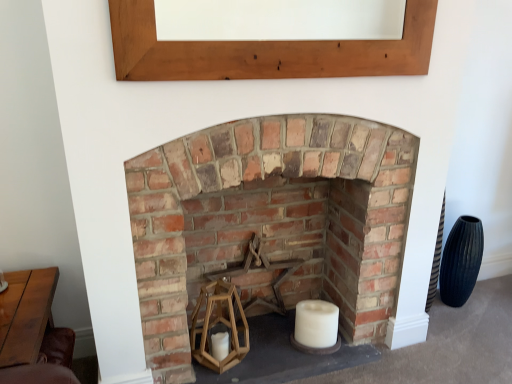
Image resolution: width=512 pixels, height=384 pixels. What are the coordinates of `free space above light brown wood at upper center (from a real-world perspective)` in the screenshot? It's located at (313, 0).